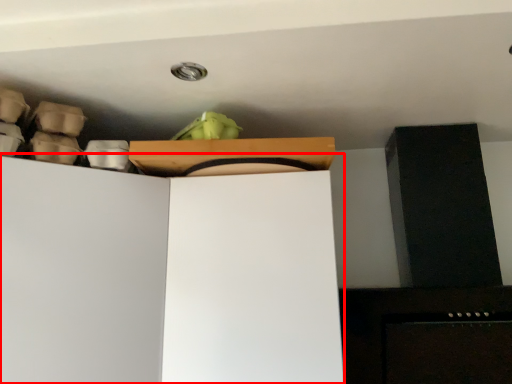
Question: From the image's perspective, what is the correct spatial relationship of cabinetry (annotated by the red box) in relation to cardboard box?

Choices:
 (A) above
 (B) below

Answer: (B)